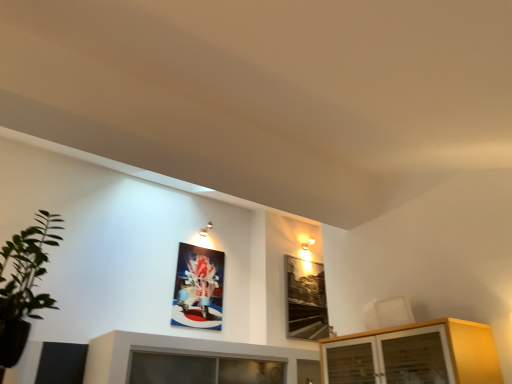
Question: Is metallic glossy picture frame at upper center, the first picture frame from the left, closer to camera compared to black glass picture frame at upper right, which appears as the first picture frame when viewed from the right?

Choices:
 (A) yes
 (B) no

Answer: (A)

Question: Is black glass picture frame at upper right, positioned as the second picture frame in left-to-right order, at the back of metallic glossy picture frame at upper center, placed as the 2th picture frame when sorted from right to left?

Choices:
 (A) no
 (B) yes

Answer: (A)

Question: From a real-world perspective, is metallic glossy picture frame at upper center, the first picture frame from the left, on black glass picture frame at upper right, which appears as the first picture frame when viewed from the right?

Choices:
 (A) yes
 (B) no

Answer: (A)

Question: Is metallic glossy picture frame at upper center, the first picture frame from the left, thinner than black glass picture frame at upper right, positioned as the second picture frame in left-to-right order?

Choices:
 (A) yes
 (B) no

Answer: (A)

Question: From the image's perspective, would you say metallic glossy picture frame at upper center, placed as the 2th picture frame when sorted from right to left, is positioned over black glass picture frame at upper right, positioned as the second picture frame in left-to-right order?

Choices:
 (A) no
 (B) yes

Answer: (B)

Question: Is metallic glossy picture frame at upper center, the first picture frame from the left, far from black glass picture frame at upper right, positioned as the second picture frame in left-to-right order?

Choices:
 (A) yes
 (B) no

Answer: (A)

Question: Is the depth of black glass picture frame at upper right, positioned as the second picture frame in left-to-right order, less than that of metallic glossy picture frame at upper center, the first picture frame from the left?

Choices:
 (A) no
 (B) yes

Answer: (A)

Question: Are black glass picture frame at upper right, which appears as the first picture frame when viewed from the right, and metallic glossy picture frame at upper center, placed as the 2th picture frame when sorted from right to left, located far from each other?

Choices:
 (A) no
 (B) yes

Answer: (B)

Question: Can you confirm if black glass picture frame at upper right, positioned as the second picture frame in left-to-right order, is positioned to the left of metallic glossy picture frame at upper center, placed as the 2th picture frame when sorted from right to left?

Choices:
 (A) no
 (B) yes

Answer: (A)

Question: Can we say black glass picture frame at upper right, which appears as the first picture frame when viewed from the right, lies outside metallic glossy picture frame at upper center, the first picture frame from the left?

Choices:
 (A) yes
 (B) no

Answer: (A)

Question: Is black glass picture frame at upper right, positioned as the second picture frame in left-to-right order, to the right of metallic glossy picture frame at upper center, the first picture frame from the left, from the viewer's perspective?

Choices:
 (A) yes
 (B) no

Answer: (A)

Question: Is black glass picture frame at upper right, positioned as the second picture frame in left-to-right order, facing away from metallic glossy picture frame at upper center, placed as the 2th picture frame when sorted from right to left?

Choices:
 (A) yes
 (B) no

Answer: (B)

Question: Considering the relative sizes of metallic glossy picture frame at upper center, placed as the 2th picture frame when sorted from right to left, and light wood cabinet at lower right in the image provided, is metallic glossy picture frame at upper center, placed as the 2th picture frame when sorted from right to left, taller than light wood cabinet at lower right?

Choices:
 (A) yes
 (B) no

Answer: (A)